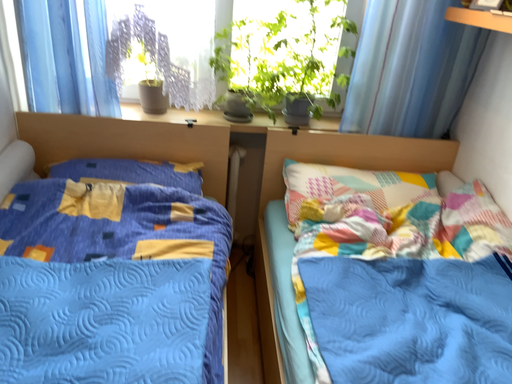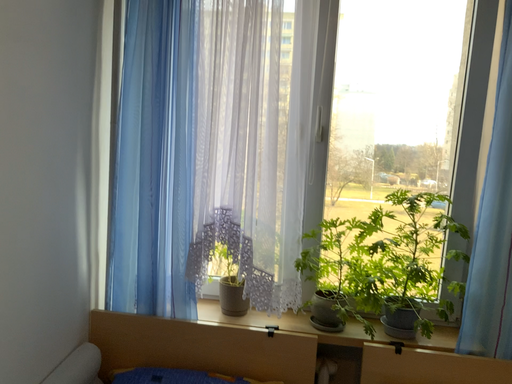
Question: How did the camera likely rotate when shooting the video?

Choices:
 (A) rotated upward
 (B) rotated downward

Answer: (A)